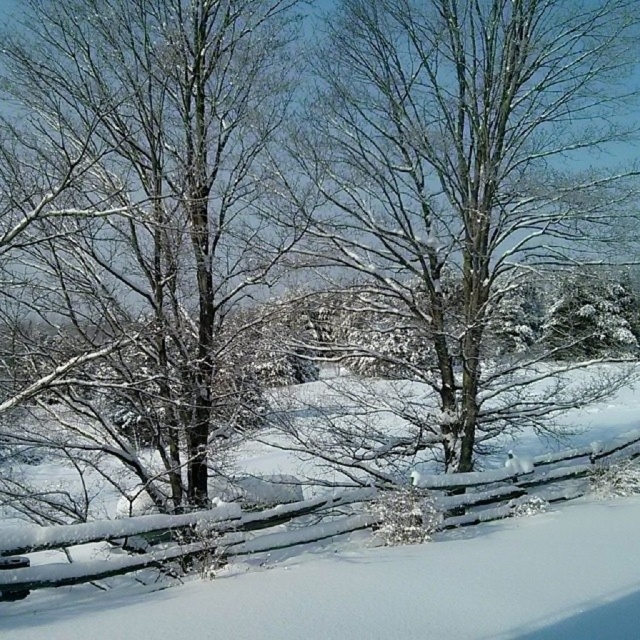
Is snow-covered branches at center to the right of wooden at lower left from the viewer's perspective?

In fact, snow-covered branches at center is to the left of wooden at lower left.

Is point (86, 288) positioned in front of point (45, 531)?

No, (86, 288) is further to viewer.

What do you see at coordinates (140, 212) in the screenshot?
I see `snow-covered branches at center` at bounding box center [140, 212].

I want to click on snow-covered branches at center, so pos(140,212).

Is snow-covered tree at center positioned behind wooden at lower left?

Yes, snow-covered tree at center is further from the viewer.

Who is more forward, (x=556, y=109) or (x=13, y=520)?

Point (x=13, y=520) is in front.

Where is `snow-covered tree at center`? The height and width of the screenshot is (640, 640). snow-covered tree at center is located at coordinates click(458, 180).

Between snow-covered branches at center and snow-covered tree at center, which one has more height?

Standing taller between the two is snow-covered branches at center.

The width and height of the screenshot is (640, 640). What do you see at coordinates (140, 212) in the screenshot?
I see `snow-covered branches at center` at bounding box center [140, 212].

Identify the location of snow-covered branches at center. The width and height of the screenshot is (640, 640). (140, 212).